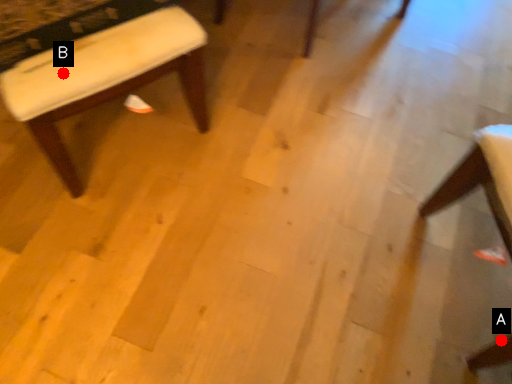
Question: Two points are circled on the image, labeled by A and B beside each circle. Among these points, which one is nearest to the camera?

Choices:
 (A) A is closer
 (B) B is closer

Answer: (B)